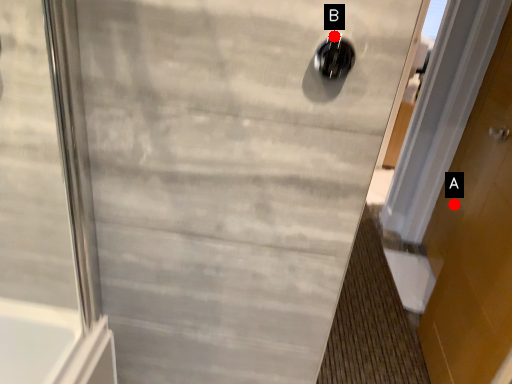
Question: Two points are circled on the image, labeled by A and B beside each circle. Which point is closer to the camera taking this photo?

Choices:
 (A) A is closer
 (B) B is closer

Answer: (B)